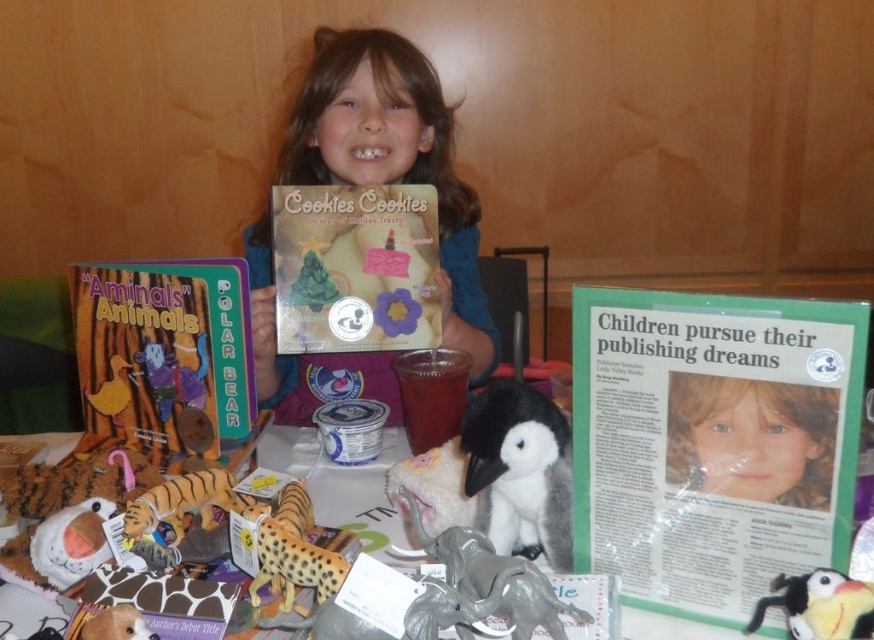
You are standing at the back of the room looking at the table where the girl is standing. There are two points marked on the table labeled point (640, 344) and point (540, 426). Which point is closer to you?

Point (540, 426) is closer to you because it is behind point (640, 344).

What is located at the point with coordinates (x=712, y=442) on the table?

The point at coordinates (x=712, y=442) on the table indicates the location of the green paper poster at center.

You are a book collector who wants to place both the matte board book at left and the matte paper book at center on a shelf that is 10 inches wide. Can both books fit side by side on the shelf without overlapping?

The matte board book at left is 7.32 inches from the matte paper book at center, so the total space needed is 7.32 inches. Since the shelf is 10 inches wide, which is wider than 7.32 inches, both books can fit side by side on the shelf without overlapping.